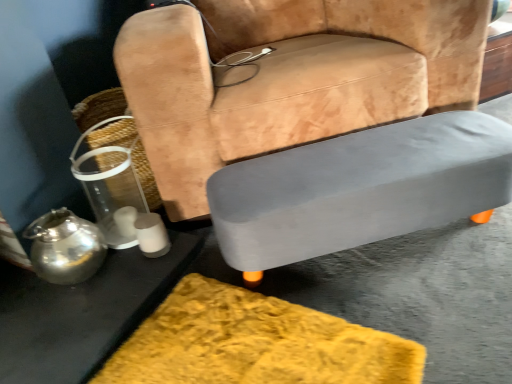
This screenshot has height=384, width=512. What do you see at coordinates (82, 312) in the screenshot? I see `metallic silver table at lower left, the first table from the left` at bounding box center [82, 312].

Measure the distance between point (x=78, y=116) and camera.

They are 5.22 feet apart.

Measure the distance between gray matte table at lower right, the 2th table when ordered from left to right, and camera.

gray matte table at lower right, the 2th table when ordered from left to right, and camera are 37.16 inches apart from each other.

The image size is (512, 384). In order to click on metallic silver table at lower left, the first table from the left in this screenshot , I will do `click(82, 312)`.

The width and height of the screenshot is (512, 384). Find the location of `table that is the 1st object directly below the suede-like tan chair at center (from a real-world perspective)`. table that is the 1st object directly below the suede-like tan chair at center (from a real-world perspective) is located at coordinates click(359, 189).

Is gray matte table at lower right, the 2th table when ordered from left to right, at the right side of suede-like tan chair at center?

Correct, you'll find gray matte table at lower right, the 2th table when ordered from left to right, to the right of suede-like tan chair at center.

Can you see gray matte table at lower right, the 2th table when ordered from left to right, touching suede-like tan chair at center?

gray matte table at lower right, the 2th table when ordered from left to right, and suede-like tan chair at center are not in contact.

Considering the sizes of gray matte table at lower right, the 1th table when ordered from right to left, and suede-like tan chair at center in the image, is gray matte table at lower right, the 1th table when ordered from right to left, taller or shorter than suede-like tan chair at center?

Considering their sizes, gray matte table at lower right, the 1th table when ordered from right to left, has less height than suede-like tan chair at center.

Consider the image. How different are the orientations of shiny metallic teapot at lower left and metallic silver table at lower left, the first table from the left, in degrees?

There is a 0.25-degree angle between the facing directions of shiny metallic teapot at lower left and metallic silver table at lower left, the first table from the left.

Considering the sizes of shiny metallic teapot at lower left and metallic silver table at lower left, the first table from the left, in the image, is shiny metallic teapot at lower left bigger or smaller than metallic silver table at lower left, the first table from the left,?

Clearly, shiny metallic teapot at lower left is smaller in size than metallic silver table at lower left, the first table from the left.

Would you consider shiny metallic teapot at lower left to be distant from metallic silver table at lower left, the first table from the left?

No, there isn't a large distance between shiny metallic teapot at lower left and metallic silver table at lower left, the first table from the left.

This screenshot has height=384, width=512. In order to click on the 2nd table below the shiny metallic teapot at lower left (from a real-world perspective) in this screenshot , I will do `click(82, 312)`.

Considering the relative sizes of shiny metallic teapot at lower left and suede-like tan chair at center in the image provided, is shiny metallic teapot at lower left thinner than suede-like tan chair at center?

Indeed, shiny metallic teapot at lower left has a lesser width compared to suede-like tan chair at center.

Does shiny metallic teapot at lower left contain suede-like tan chair at center?

No, suede-like tan chair at center is not inside shiny metallic teapot at lower left.

Locate an element on the screen. The height and width of the screenshot is (384, 512). tea pot below the suede-like tan chair at center (from the image's perspective) is located at coordinates (65, 247).

Does shiny metallic teapot at lower left have a smaller size compared to suede-like tan chair at center?

Yes, shiny metallic teapot at lower left is smaller than suede-like tan chair at center.

Can you confirm if clear plastic basket at left is smaller than gray matte table at lower right, the 1th table when ordered from right to left?

Indeed, clear plastic basket at left has a smaller size compared to gray matte table at lower right, the 1th table when ordered from right to left.

Is clear plastic basket at left not near gray matte table at lower right, the 1th table when ordered from right to left?

No, clear plastic basket at left is not far away from gray matte table at lower right, the 1th table when ordered from right to left.

Which is in front, point (137, 160) or point (486, 206)?

Point (486, 206)

Measure the distance from metallic silver table at lower left, the second table in the right-to-left sequence, to shiny metallic teapot at lower left.

5.44 inches.

Where is `tea pot on the right of metallic silver table at lower left, the first table from the left`? This screenshot has width=512, height=384. tea pot on the right of metallic silver table at lower left, the first table from the left is located at coordinates (65, 247).

Between point (174, 255) and point (31, 252), which one is positioned behind?

Positioned behind is point (174, 255).

Considering the positions of objects clear plastic basket at left and metallic silver table at lower left, the second table in the right-to-left sequence, in the image provided, who is behind, clear plastic basket at left or metallic silver table at lower left, the second table in the right-to-left sequence,?

clear plastic basket at left.

Considering the sizes of objects clear plastic basket at left and metallic silver table at lower left, the second table in the right-to-left sequence, in the image provided, who is bigger, clear plastic basket at left or metallic silver table at lower left, the second table in the right-to-left sequence,?

Bigger between the two is clear plastic basket at left.

Does clear plastic basket at left have a greater height compared to metallic silver table at lower left, the second table in the right-to-left sequence?

Yes.

Is gray matte table at lower right, the 2th table when ordered from left to right, at the right side of metallic silver table at lower left, the second table in the right-to-left sequence?

Yes.

Does gray matte table at lower right, the 1th table when ordered from right to left, come in front of metallic silver table at lower left, the first table from the left?

No.

Who is shorter, gray matte table at lower right, the 2th table when ordered from left to right, or metallic silver table at lower left, the second table in the right-to-left sequence?

metallic silver table at lower left, the second table in the right-to-left sequence.

Is gray matte table at lower right, the 1th table when ordered from right to left, aimed at metallic silver table at lower left, the second table in the right-to-left sequence?

No.

Locate an element on the screen. This screenshot has height=384, width=512. chair lying in front of the gray matte table at lower right, the 2th table when ordered from left to right is located at coordinates (288, 77).

Identify the location of table on the left of shiny metallic teapot at lower left. The height and width of the screenshot is (384, 512). (82, 312).

Which object lies nearer to the anchor point gray matte table at lower right, the 2th table when ordered from left to right, suede-like tan chair at center or clear plastic basket at left?

Based on the image, suede-like tan chair at center appears to be nearer to gray matte table at lower right, the 2th table when ordered from left to right.

From the picture: Looking at the image, which one is located closer to clear plastic basket at left, metallic silver table at lower left, the second table in the right-to-left sequence, or gray matte table at lower right, the 2th table when ordered from left to right?

Among the two, metallic silver table at lower left, the second table in the right-to-left sequence, is located nearer to clear plastic basket at left.

Based on their spatial positions, is shiny metallic teapot at lower left or metallic silver table at lower left, the second table in the right-to-left sequence, further from clear plastic basket at left?

metallic silver table at lower left, the second table in the right-to-left sequence, is positioned further to the anchor clear plastic basket at left.

Estimate the real-world distances between objects in this image. Which object is further from suede-like tan chair at center, clear plastic basket at left or shiny metallic teapot at lower left?

shiny metallic teapot at lower left lies further to suede-like tan chair at center than the other object.

From the picture: Considering their positions, is clear plastic basket at left positioned closer to metallic silver table at lower left, the first table from the left, than suede-like tan chair at center?

Based on the image, clear plastic basket at left appears to be nearer to metallic silver table at lower left, the first table from the left.

Considering their positions, is suede-like tan chair at center positioned further to clear plastic basket at left than gray matte table at lower right, the 1th table when ordered from right to left?

Based on the image, gray matte table at lower right, the 1th table when ordered from right to left, appears to be further to clear plastic basket at left.

Which object lies further to the anchor point metallic silver table at lower left, the first table from the left, gray matte table at lower right, the 1th table when ordered from right to left, or suede-like tan chair at center?

Based on the image, suede-like tan chair at center appears to be further to metallic silver table at lower left, the first table from the left.

From the image, which object appears to be farther from gray matte table at lower right, the 1th table when ordered from right to left, metallic silver table at lower left, the first table from the left, or clear plastic basket at left?

The object further to gray matte table at lower right, the 1th table when ordered from right to left, is clear plastic basket at left.

You are a GUI agent. You are given a task and a screenshot of the screen. Output one action in this format:
    pyautogui.click(x=<x>, y=<y>)
    Task: Click on the tea pot between suede-like tan chair at center and metallic silver table at lower left, the second table in the right-to-left sequence, from top to bottom
    The height and width of the screenshot is (384, 512).
    Given the screenshot: What is the action you would take?
    coord(65,247)

The height and width of the screenshot is (384, 512). I want to click on tea pot that lies between clear plastic basket at left and metallic silver table at lower left, the first table from the left, from top to bottom, so click(65, 247).

At what (x,y) coordinates should I click in order to perform the action: click on basket that lies between suede-like tan chair at center and metallic silver table at lower left, the first table from the left, from top to bottom. Please return your answer as a coordinate pair (x, y). The height and width of the screenshot is (384, 512). Looking at the image, I should click on (116, 134).

Locate an element on the screen. The width and height of the screenshot is (512, 384). tea pot between metallic silver table at lower left, the first table from the left, and gray matte table at lower right, the 2th table when ordered from left to right, from left to right is located at coordinates (65, 247).